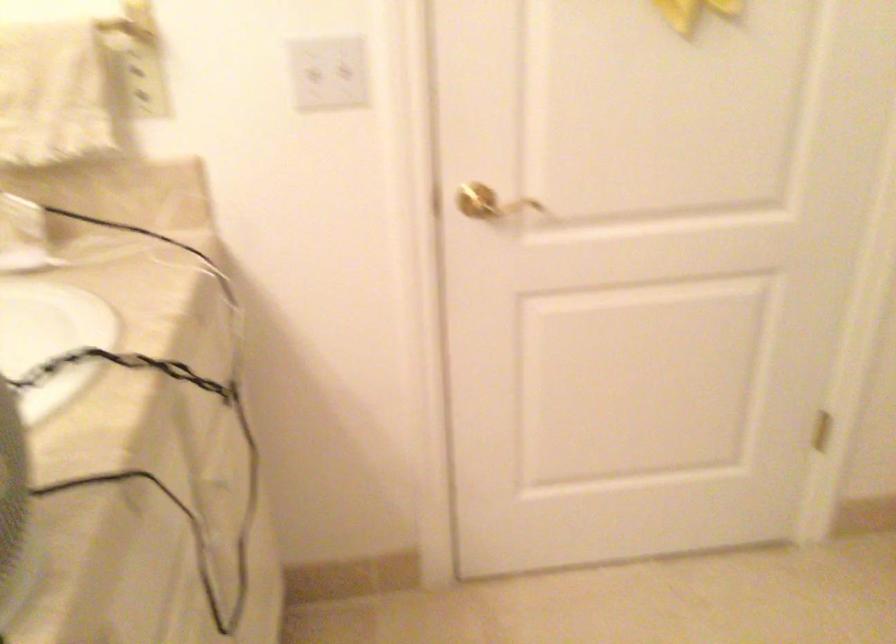
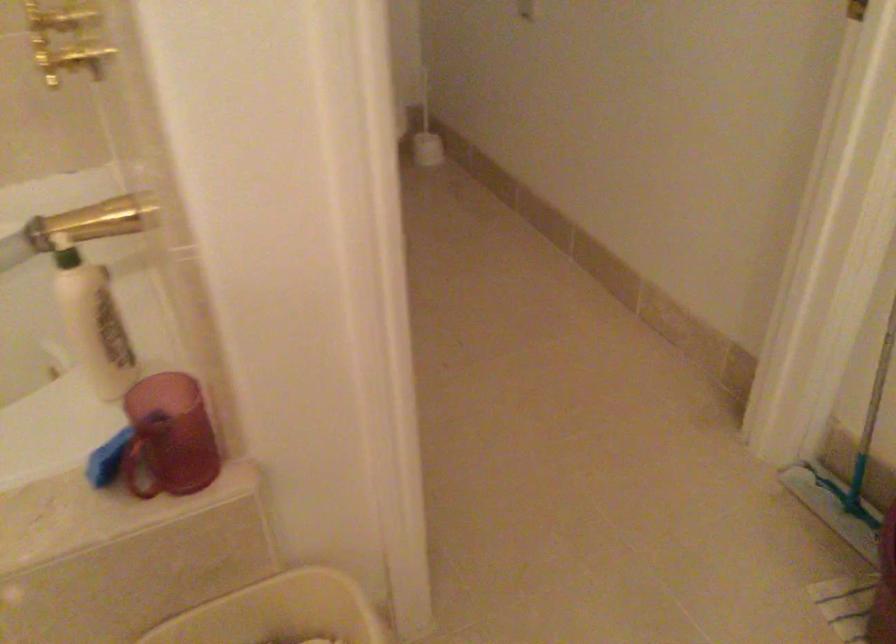
How did the camera likely rotate?

The camera rotated toward right-down.